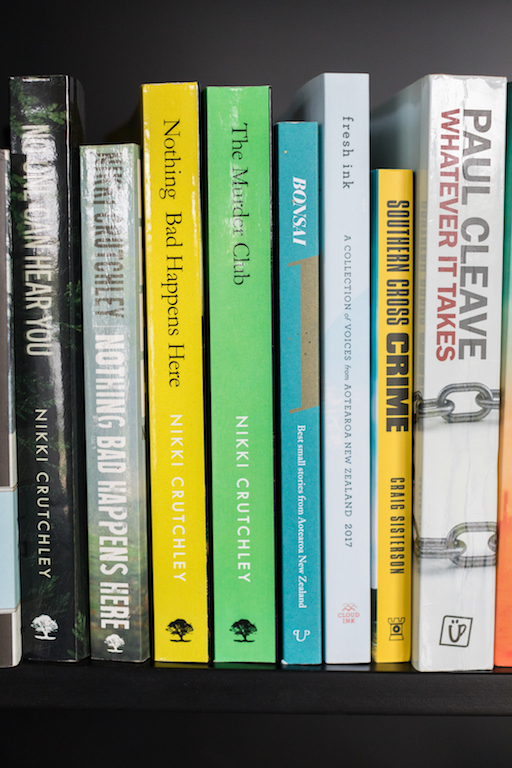
Where is `book`? Image resolution: width=512 pixels, height=768 pixels. book is located at coordinates (454, 319), (407, 328), (343, 355), (310, 348), (234, 320), (178, 333), (121, 343), (50, 346), (5, 416), (505, 392).